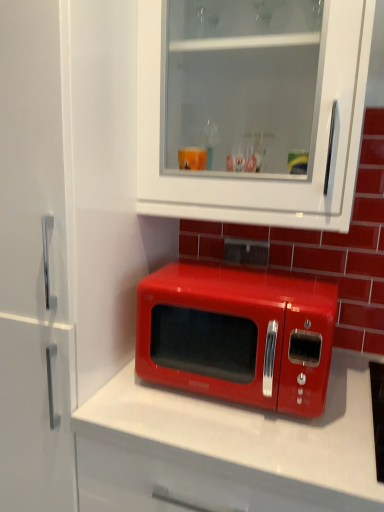
Question: From the image's perspective, is white glossy cabinet at upper center located above glossy red microwave at center?

Choices:
 (A) no
 (B) yes

Answer: (B)

Question: Can you confirm if white glossy cabinet at upper center is smaller than glossy red microwave at center?

Choices:
 (A) no
 (B) yes

Answer: (A)

Question: From a real-world perspective, is white glossy cabinet at upper center on glossy red microwave at center?

Choices:
 (A) no
 (B) yes

Answer: (B)

Question: Is the surface of white glossy cabinet at upper center in direct contact with glossy red microwave at center?

Choices:
 (A) yes
 (B) no

Answer: (B)

Question: Does white glossy cabinet at upper center come behind glossy red microwave at center?

Choices:
 (A) yes
 (B) no

Answer: (B)

Question: Can you confirm if white glossy cabinet at upper center is taller than glossy red microwave at center?

Choices:
 (A) no
 (B) yes

Answer: (B)

Question: Is glossy red microwave at center turned away from white glossy cabinet at upper center?

Choices:
 (A) yes
 (B) no

Answer: (B)

Question: Does glossy red microwave at center have a greater width compared to white glossy cabinet at upper center?

Choices:
 (A) no
 (B) yes

Answer: (B)

Question: Does glossy red microwave at center have a greater height compared to white glossy cabinet at upper center?

Choices:
 (A) yes
 (B) no

Answer: (B)

Question: Is glossy red microwave at center smaller than white glossy cabinet at upper center?

Choices:
 (A) yes
 (B) no

Answer: (A)

Question: From the image's perspective, is glossy red microwave at center under white glossy cabinet at upper center?

Choices:
 (A) no
 (B) yes

Answer: (B)

Question: Would you say glossy red microwave at center contains white glossy cabinet at upper center?

Choices:
 (A) no
 (B) yes

Answer: (A)

Question: Looking at the image, does glossy red microwave at center seem bigger or smaller compared to white glossy cabinet at upper center?

Choices:
 (A) big
 (B) small

Answer: (B)